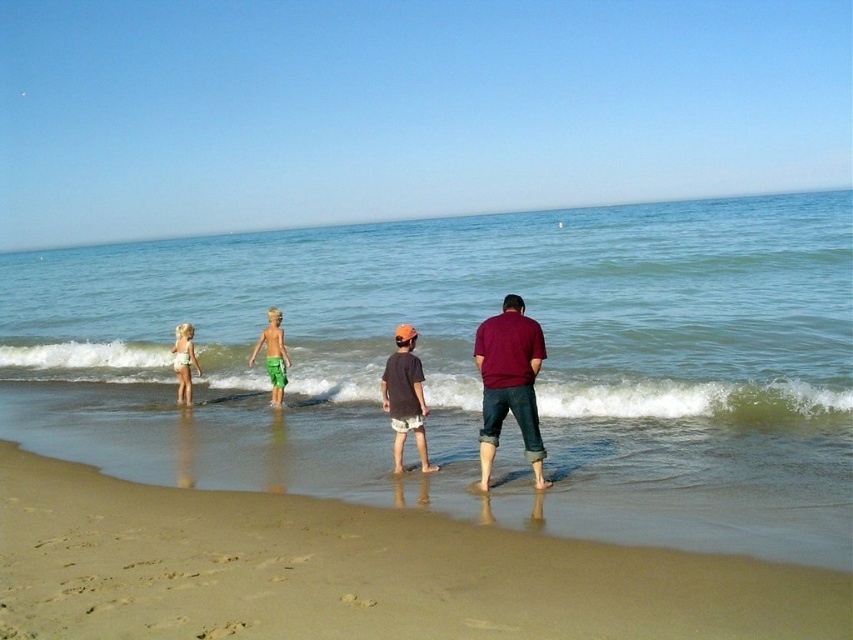
Question: Does sandy beach at lower center come behind dark gray cotton shirt at center?

Choices:
 (A) yes
 (B) no

Answer: (B)

Question: Is the position of clear blue water at center more distant than that of maroon fabric shirt at center?

Choices:
 (A) no
 (B) yes

Answer: (A)

Question: Which point is closer to the camera?

Choices:
 (A) click(248, 358)
 (B) click(671, 589)
 (C) click(398, 451)
 (D) click(486, 448)

Answer: (B)

Question: Which point is farther from the camera taking this photo?

Choices:
 (A) (416, 448)
 (B) (453, 317)
 (C) (177, 369)

Answer: (B)

Question: Is sandy beach at lower center closer to the viewer compared to white cloth at left?

Choices:
 (A) no
 (B) yes

Answer: (B)

Question: Which point appears farthest from the camera in this image?

Choices:
 (A) (181, 355)
 (B) (660, 442)
 (C) (526, 336)
 (D) (399, 458)

Answer: (A)